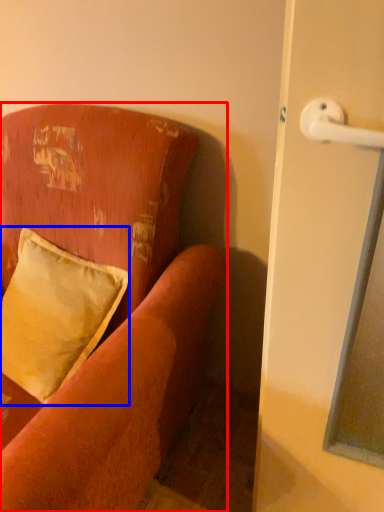
Question: Which object appears farthest to the camera in this image, studio couch (highlighted by a red box) or pillow (highlighted by a blue box)?

Choices:
 (A) studio couch
 (B) pillow

Answer: (B)